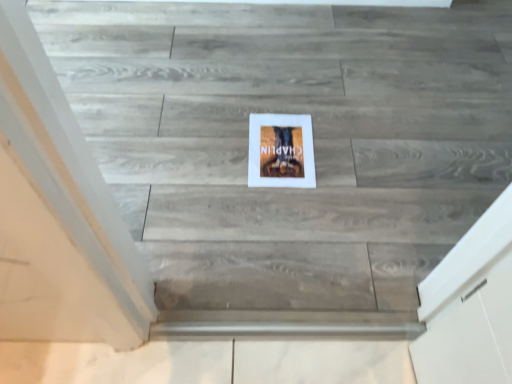
Question: Should I look upward or downward to see white matte picture frame at center?

Choices:
 (A) up
 (B) down

Answer: (A)